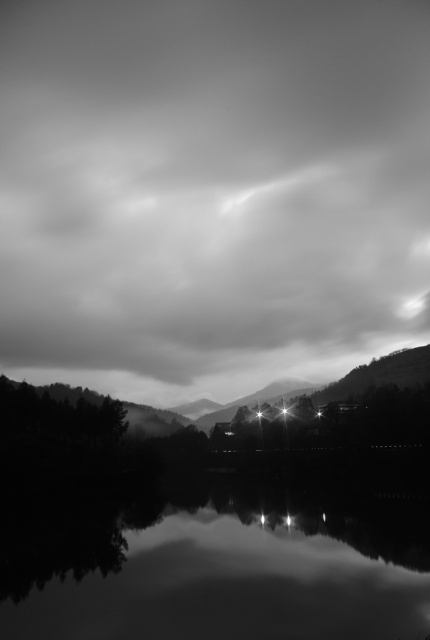
Question: Does cloudy sky at upper center appear on the left side of smooth water at center?

Choices:
 (A) no
 (B) yes

Answer: (B)

Question: Is cloudy sky at upper center positioned in front of smooth water at center?

Choices:
 (A) yes
 (B) no

Answer: (B)

Question: Which object appears closest to the camera in this image?

Choices:
 (A) smooth water at center
 (B) cloudy sky at upper center

Answer: (A)

Question: Is cloudy sky at upper center above smooth water at center?

Choices:
 (A) no
 (B) yes

Answer: (B)

Question: Which point is farther from the camera taking this photo?

Choices:
 (A) (181, 342)
 (B) (116, 568)

Answer: (A)